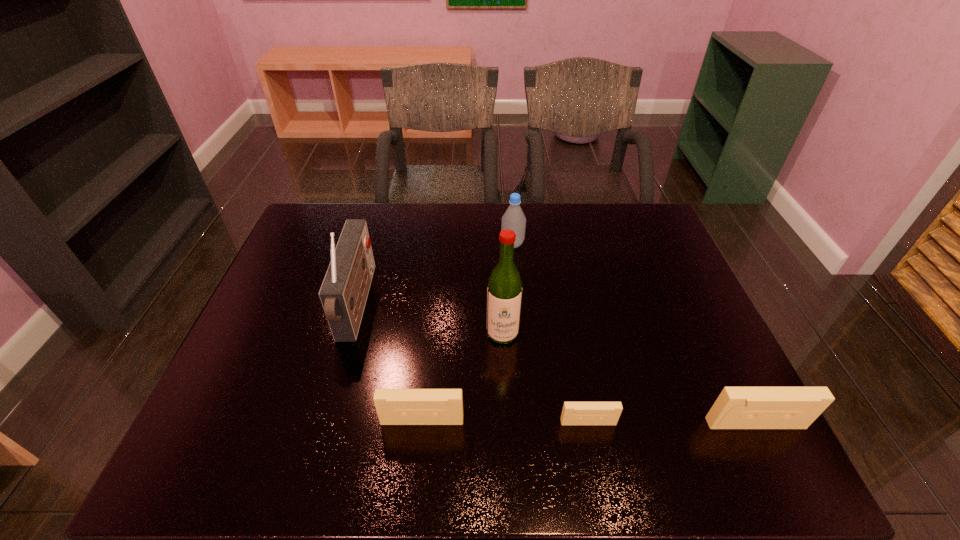
Image resolution: width=960 pixels, height=540 pixels. Identify the location of free point located on the right of the bottle. (605, 244).

You are a GUI agent. You are given a task and a screenshot of the screen. Output one action in this format:
    pyautogui.click(x=<x>, y=<y>)
    Task: Click on the blank space located on the front panel of the leftmost object
    
    Given the screenshot: What is the action you would take?
    pyautogui.click(x=481, y=305)

Image resolution: width=960 pixels, height=540 pixels. I want to click on vacant space located on the label of the tallest object, so pyautogui.click(x=504, y=368).

Locate an element on the screen. object located at the far edge is located at coordinates 514,219.

This screenshot has height=540, width=960. Find the location of `object at the right edge`. object at the right edge is located at coordinates (736, 407).

I want to click on object positioned at the near right corner, so click(736, 407).

This screenshot has height=540, width=960. What are the coordinates of `vacant space at the far edge` in the screenshot? It's located at (524, 206).

In the image, there is a desktop. At what (x,y) coordinates should I click in order to perform the action: click on free region at the near edge. Please return your answer as a coordinate pair (x, y). The height and width of the screenshot is (540, 960). Looking at the image, I should click on (318, 411).

Identify the location of free point at the right edge. (662, 285).

Locate an element on the screen. vacant space at the far left corner of the desktop is located at coordinates (329, 244).